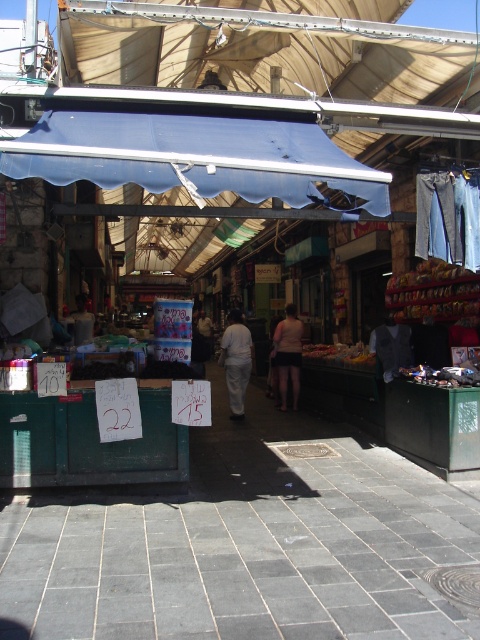
Question: Considering the real-world distances, which object is farthest from the white cotton pants at center?

Choices:
 (A) blue fabric canopy at upper center
 (B) light beige shorts at center

Answer: (A)

Question: Can you confirm if white cotton pants at center is wider than light beige shorts at center?

Choices:
 (A) yes
 (B) no

Answer: (B)

Question: Considering the relative positions of blue fabric canopy at upper center and light beige shorts at center in the image provided, where is blue fabric canopy at upper center located with respect to light beige shorts at center?

Choices:
 (A) below
 (B) above

Answer: (B)

Question: Based on their relative distances, which object is farther from the white cotton pants at center?

Choices:
 (A) blue fabric canopy at upper center
 (B) light beige shorts at center

Answer: (A)

Question: From the image, what is the correct spatial relationship of blue fabric canopy at upper center in relation to white cotton pants at center?

Choices:
 (A) right
 (B) left

Answer: (B)

Question: Which point is closer to the camera taking this photo?

Choices:
 (A) (229, 340)
 (B) (299, 368)
 (C) (87, 168)

Answer: (C)